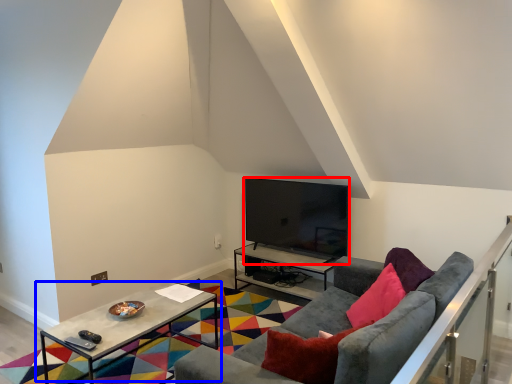
Question: Among these objects, which one is nearest to the camera, television (highlighted by a red box) or table (highlighted by a blue box)?

Choices:
 (A) television
 (B) table

Answer: (B)